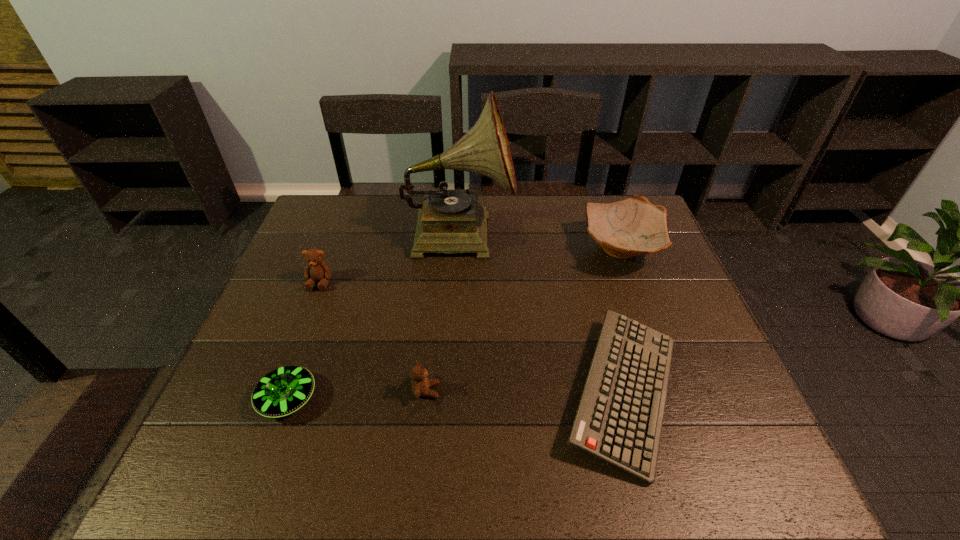
Find the location of a particular element. The image size is (960, 540). vacant point located between the pottery and the saucer is located at coordinates (455, 324).

Where is `free space between the saucer and the record player`? Image resolution: width=960 pixels, height=540 pixels. free space between the saucer and the record player is located at coordinates tap(373, 316).

Locate an element on the screen. This screenshot has height=540, width=960. vacant area that lies between the computer keyboard and the saucer is located at coordinates (456, 395).

Where is `free space between the tallest object and the right teddy bear`? free space between the tallest object and the right teddy bear is located at coordinates (443, 312).

The image size is (960, 540). I want to click on free point between the tallest object and the shortest object, so click(541, 313).

The height and width of the screenshot is (540, 960). Identify the location of free point between the pottery and the record player. (541, 241).

Point out which object is positioned as the second nearest to the shortest object. Please provide its 2D coordinates. Your answer should be formatted as a tuple, i.e. [(x, y)], where the tuple contains the x and y coordinates of a point satisfying the conditions above.

[(449, 221)]

At what (x,y) coordinates should I click in order to perform the action: click on object that stands as the closest to the pottery. Please return your answer as a coordinate pair (x, y). Looking at the image, I should click on (619, 419).

This screenshot has height=540, width=960. I want to click on free space that satisfies the following two spatial constraints: 1. from the horn of the tallest object; 2. on the front side of the saucer, so click(450, 399).

The width and height of the screenshot is (960, 540). Find the location of `free space that satisfies the following two spatial constraints: 1. from the horn of the record player; 2. on the left side of the pottery`. free space that satisfies the following two spatial constraints: 1. from the horn of the record player; 2. on the left side of the pottery is located at coordinates (459, 249).